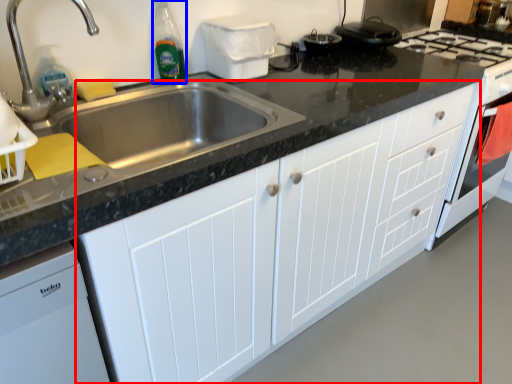
Question: Which point is further to the camera, cabinetry (highlighted by a red box) or bottle (highlighted by a blue box)?

Choices:
 (A) cabinetry
 (B) bottle

Answer: (B)